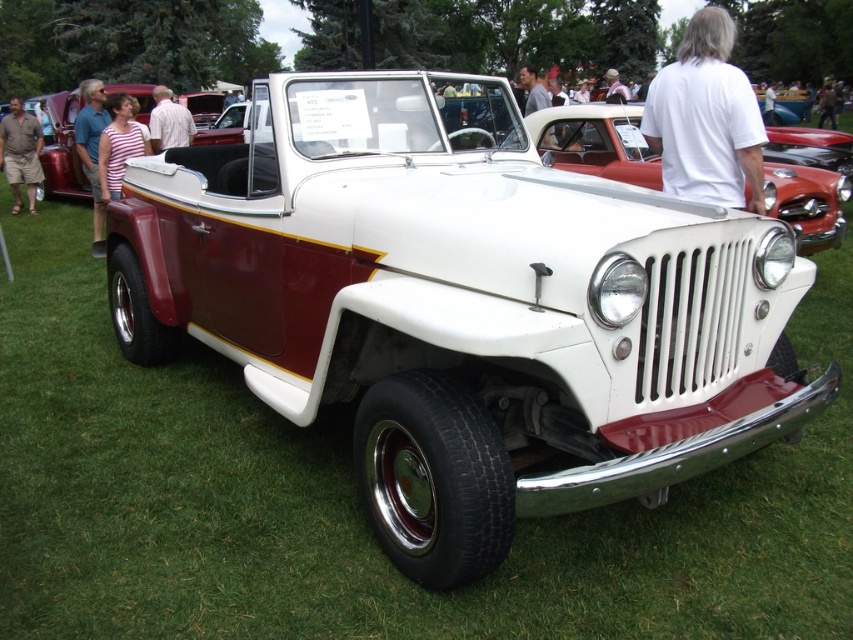
Question: Considering the relative positions of white cotton shirt at upper right and brown shorts at lower left in the image provided, where is white cotton shirt at upper right located with respect to brown shorts at lower left?

Choices:
 (A) right
 (B) left

Answer: (A)

Question: Which object is closer to the camera taking this photo?

Choices:
 (A) blue shirt at left
 (B) brown shorts at lower left
 (C) white cotton shirt at upper right

Answer: (C)

Question: Which of the following is the closest to the observer?

Choices:
 (A) (16, 180)
 (B) (158, 131)
 (C) (560, 164)
 (D) (695, 136)

Answer: (D)

Question: Does white cotton shirt at upper right appear on the left side of blue shirt at left?

Choices:
 (A) no
 (B) yes

Answer: (A)

Question: Considering the real-world distances, which object is farthest from the white matte jeep at center?

Choices:
 (A) white cotton shirt at center
 (B) white cotton shirt at upper right
 (C) blue shirt at left

Answer: (A)

Question: Does white matte jeep at center appear over white cotton shirt at center?

Choices:
 (A) yes
 (B) no

Answer: (B)